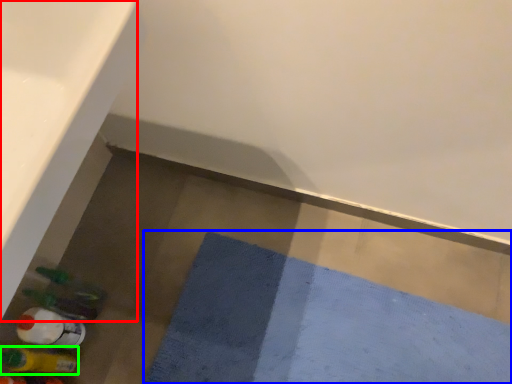
Question: Which object is positioned farthest from bath (highlighted by a red box)? Select from bath mat (highlighted by a blue box) and bottle (highlighted by a green box).

Choices:
 (A) bath mat
 (B) bottle

Answer: (A)